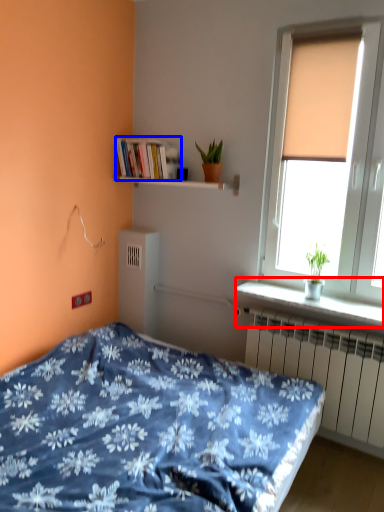
Question: Which point is closer to the camera, window sill (highlighted by a red box) or book (highlighted by a blue box)?

Choices:
 (A) window sill
 (B) book

Answer: (A)